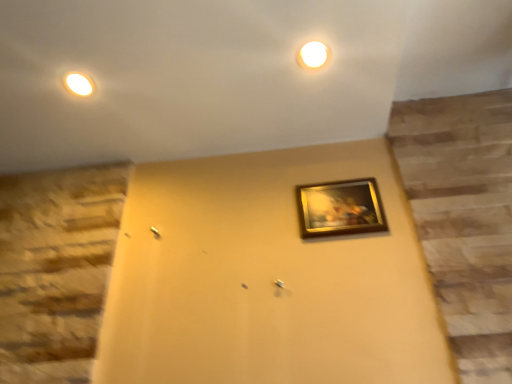
Question: Based on their sizes in the image, would you say white glossy light at upper center is bigger or smaller than gold-framed painting at center?

Choices:
 (A) big
 (B) small

Answer: (B)

Question: Is point (321, 54) positioned closer to the camera than point (311, 221)?

Choices:
 (A) closer
 (B) farther

Answer: (A)

Question: From a real-world perspective, is white glossy light at upper center positioned above or below gold-framed painting at center?

Choices:
 (A) below
 (B) above

Answer: (B)

Question: From a real-world perspective, is gold-framed painting at center positioned above or below white glossy light at upper center?

Choices:
 (A) below
 (B) above

Answer: (A)

Question: In terms of size, does gold-framed painting at center appear bigger or smaller than white glossy light at upper center?

Choices:
 (A) small
 (B) big

Answer: (B)

Question: Is gold-framed painting at center taller or shorter than white glossy light at upper center?

Choices:
 (A) tall
 (B) short

Answer: (A)

Question: In the image, is gold-framed painting at center positioned in front of or behind white glossy light at upper center?

Choices:
 (A) front
 (B) behind

Answer: (B)